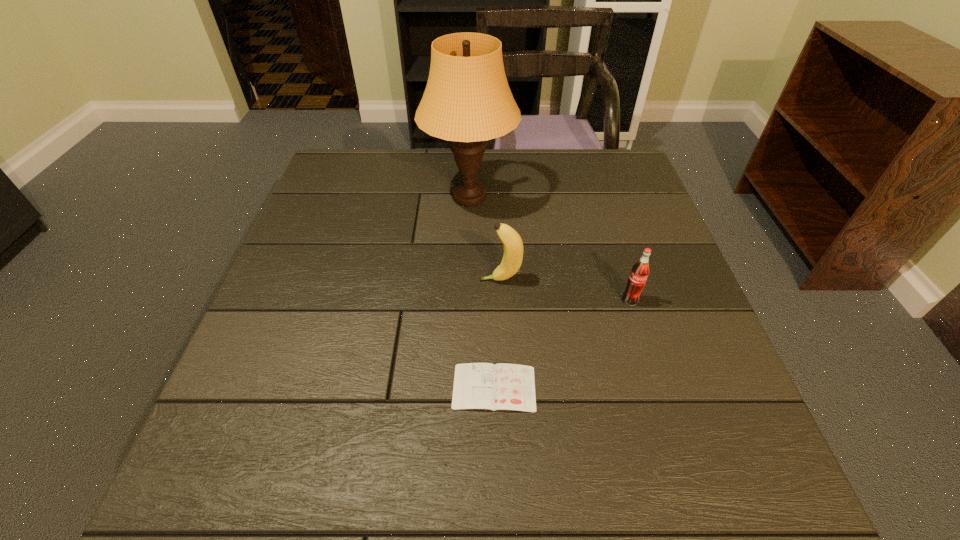
You are a GUI agent. You are given a task and a screenshot of the screen. Output one action in this format:
    pyautogui.click(x=<x>, y=<y>)
    Task: Click on the empty location between the tallest object and the shortest object
    
    Given the screenshot: What is the action you would take?
    pyautogui.click(x=482, y=292)

This screenshot has width=960, height=540. I want to click on free spot between the second nearest object and the banana, so click(565, 290).

Where is `empty space between the nearest object and the tallest object`? The width and height of the screenshot is (960, 540). empty space between the nearest object and the tallest object is located at coordinates (482, 292).

I want to click on unoccupied area between the rightmost object and the diary, so click(x=563, y=344).

In order to click on unoccupied position between the banana and the rightmost object in this screenshot , I will do `click(565, 290)`.

This screenshot has height=540, width=960. I want to click on vacant space that's between the tallest object and the soda bottle, so click(550, 249).

This screenshot has width=960, height=540. In order to click on vacant area that lies between the tallest object and the nearest object in this screenshot , I will do `click(482, 292)`.

What are the coordinates of `empty space that is in between the shortest object and the banana` in the screenshot? It's located at (497, 334).

Locate an element on the screen. Image resolution: width=960 pixels, height=540 pixels. vacant space in between the shortest object and the second farthest object is located at coordinates pos(497,334).

This screenshot has width=960, height=540. Identify the location of vacant region between the banana and the shortest object. (497, 334).